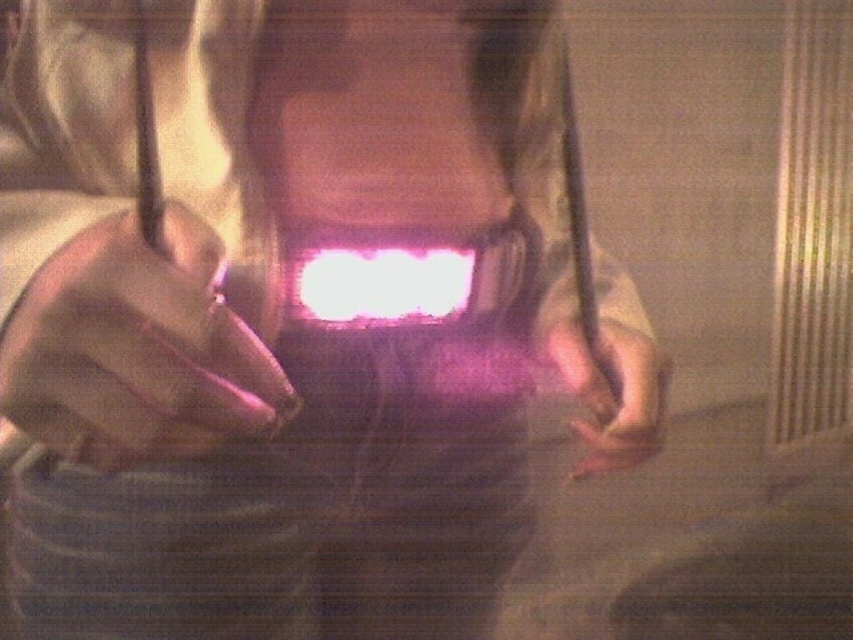
Question: Which point is farther to the camera?

Choices:
 (A) pink matte hand at lower right
 (B) matte purple glove at center
 (C) bright white light at center

Answer: (A)

Question: Is matte purple glove at center to the left of bright white light at center from the viewer's perspective?

Choices:
 (A) yes
 (B) no

Answer: (A)

Question: Does matte purple glove at center appear on the right side of pink matte hand at lower right?

Choices:
 (A) no
 (B) yes

Answer: (A)

Question: Among these objects, which one is nearest to the camera?

Choices:
 (A) bright white light at center
 (B) pink matte hand at lower right

Answer: (A)

Question: Does matte purple glove at center lie in front of bright white light at center?

Choices:
 (A) yes
 (B) no

Answer: (A)

Question: Based on their relative distances, which object is nearer to the matte purple glove at center?

Choices:
 (A) bright white light at center
 (B) pink matte hand at lower right

Answer: (A)